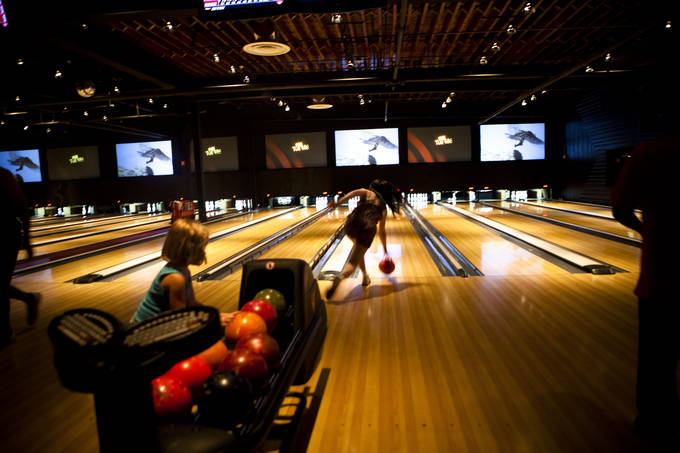
Locate an element on the screen. screens is located at coordinates (375, 139), (438, 138), (524, 154), (279, 157), (228, 163), (128, 159), (80, 169), (29, 172).